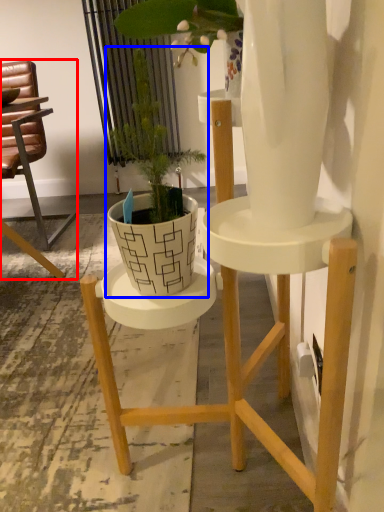
Question: Which point is further to the camera, chair (highlighted by a red box) or houseplant (highlighted by a blue box)?

Choices:
 (A) chair
 (B) houseplant

Answer: (A)